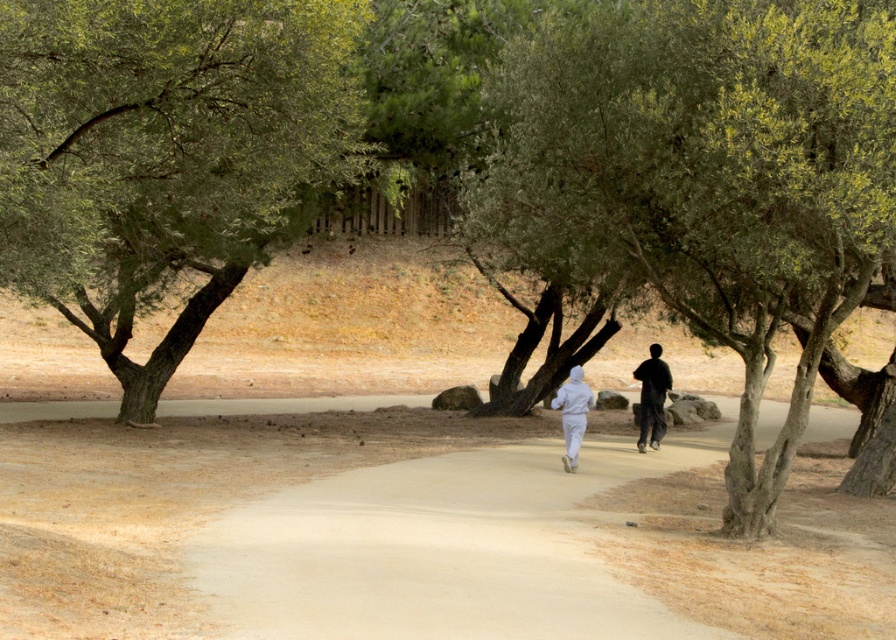
Is green leafy tree at left shorter than white matte hoodie at center?

No, green leafy tree at left is not shorter than white matte hoodie at center.

Can you confirm if green leafy tree at left is positioned above white matte hoodie at center?

Indeed, green leafy tree at left is positioned over white matte hoodie at center.

Between point (234, 83) and point (652, 440), which one is positioned behind?

Positioned behind is point (652, 440).

Find the location of `green leafy tree at left`. green leafy tree at left is located at coordinates (164, 154).

Is light brown dirt track at center in front of dark gray hoodie at center?

Yes, it is.

Based on the photo, between light brown dirt track at center and dark gray hoodie at center, which one has more height?

dark gray hoodie at center is taller.

Between point (161, 550) and point (655, 422), which one is positioned behind?

Point (655, 422)

The width and height of the screenshot is (896, 640). I want to click on light brown dirt track at center, so click(x=415, y=532).

Locate an element on the screen. green leafy tree at center is located at coordinates (709, 177).

Is point (739, 506) farther from camera compared to point (296, 56)?

Yes, it is behind point (296, 56).

Identify the location of green leafy tree at center. (709, 177).

The image size is (896, 640). Find the location of `green leafy tree at center`. green leafy tree at center is located at coordinates (709, 177).